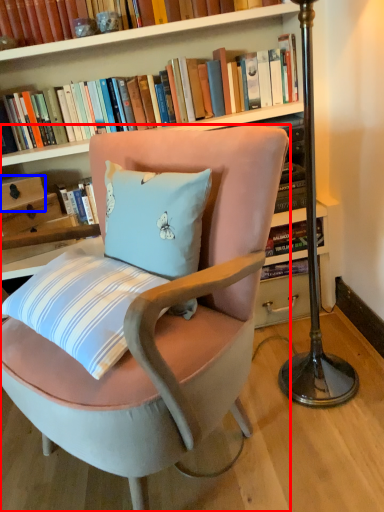
Question: Which object appears closest to the camera in this image, chair (highlighted by a red box) or drawer (highlighted by a blue box)?

Choices:
 (A) chair
 (B) drawer

Answer: (A)